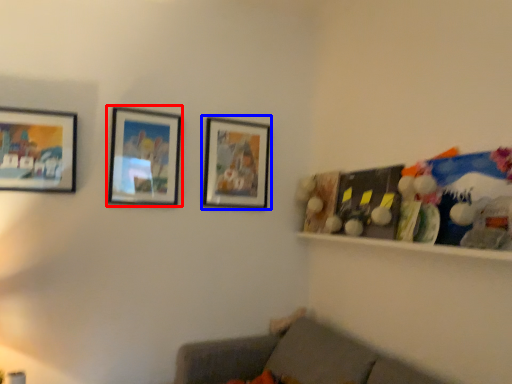
Question: Among these objects, which one is farthest to the camera, picture frame (highlighted by a red box) or picture frame (highlighted by a blue box)?

Choices:
 (A) picture frame
 (B) picture frame

Answer: (B)